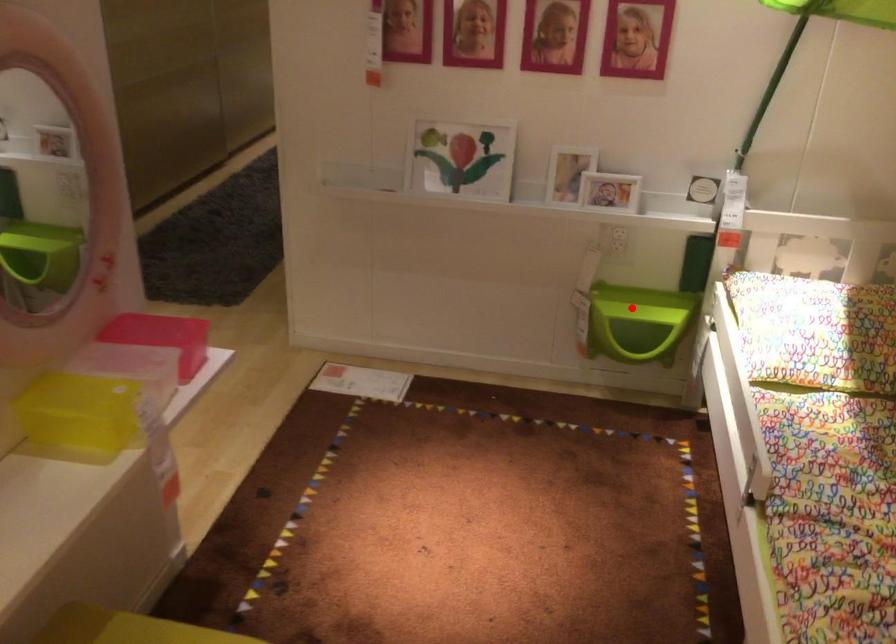
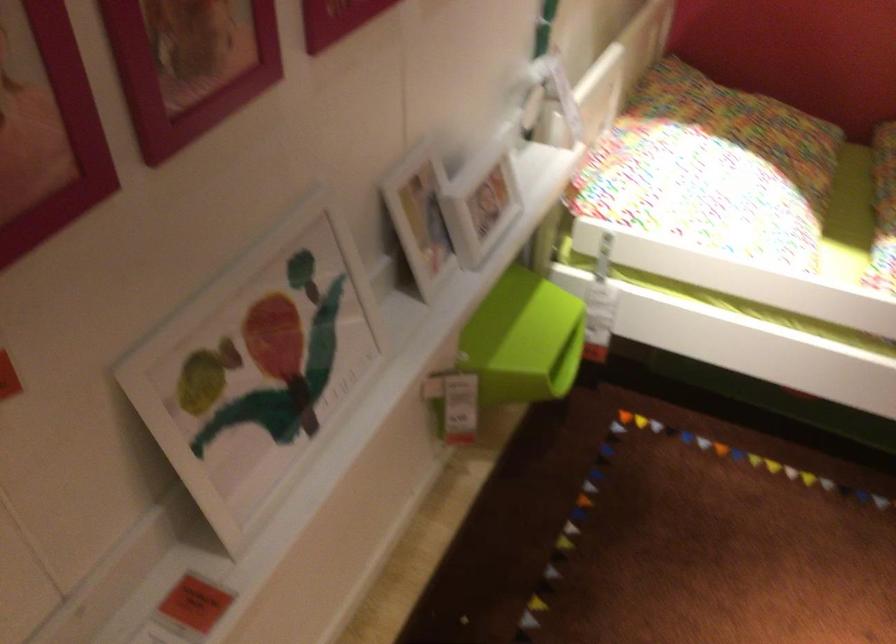
Question: I am providing you with two images of the same scene from different viewpoints. Image1 has a red point marked. In image2, the corresponding 3D location appears at what relative position? Reply with the corresponding letter.

Choices:
 (A) Closer
 (B) Farther

Answer: (A)